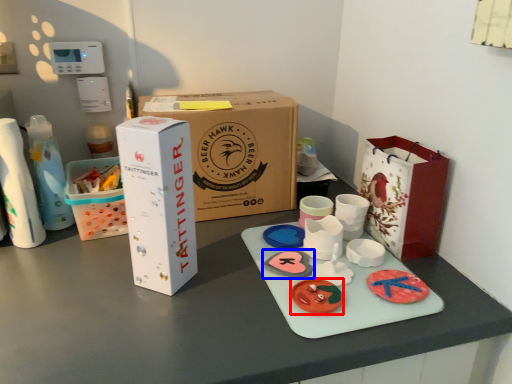
Question: Which object appears farthest to the camera in this image, toy (highlighted by a red box) or toy (highlighted by a blue box)?

Choices:
 (A) toy
 (B) toy

Answer: (B)